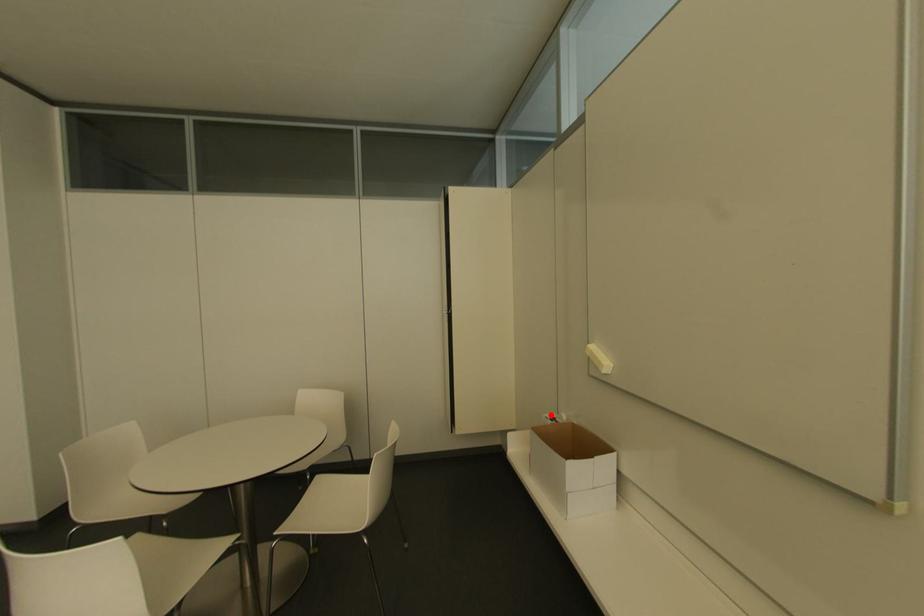
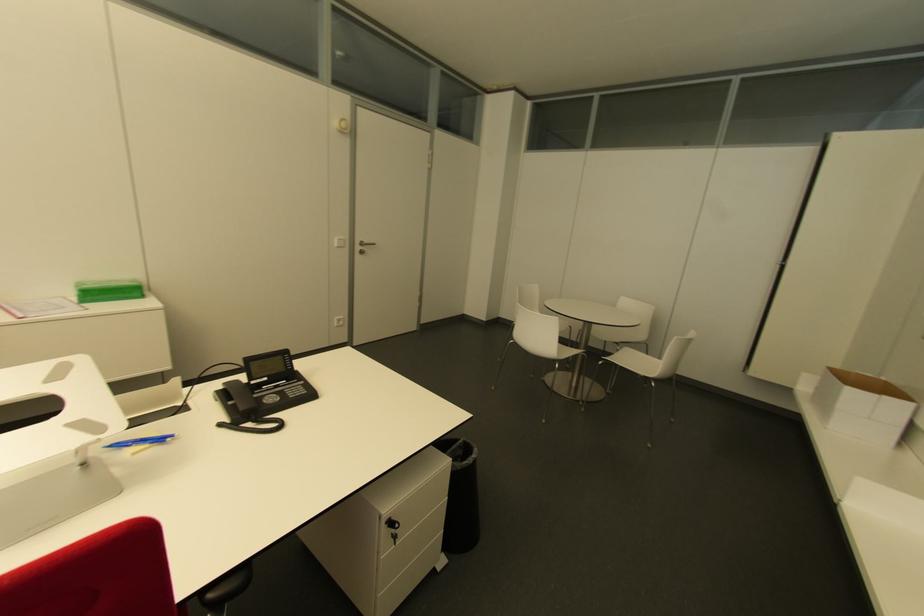
Question: A red point is marked in image1. In image2, is the corresponding 3D point closer to the camera or farther? Reply with the corresponding letter.

Choices:
 (A) The corresponding 3D point is closer.
 (B) The corresponding 3D point is farther.

Answer: (B)